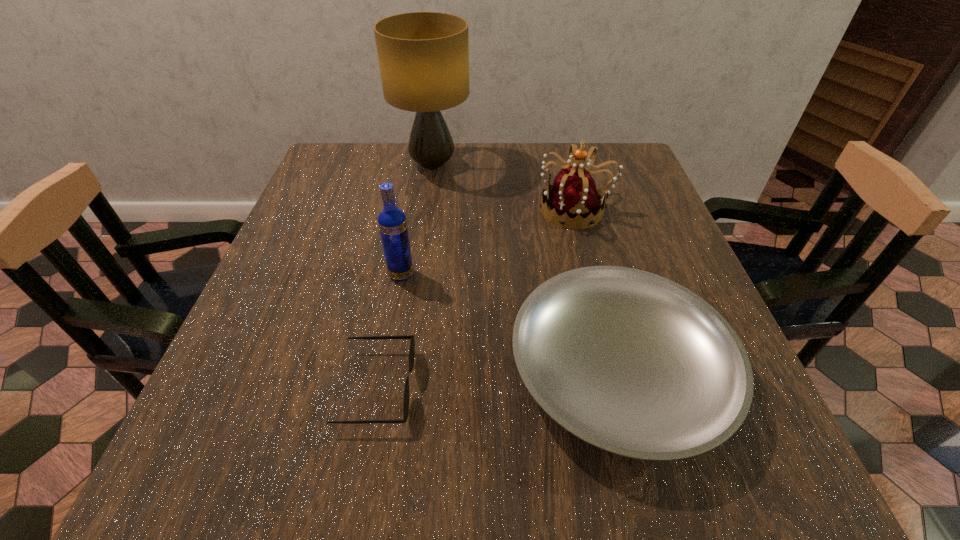
Find the location of a particular element. The width and height of the screenshot is (960, 540). the farthest object is located at coordinates (423, 57).

Identify the location of the tallest object. The height and width of the screenshot is (540, 960). (423, 57).

Locate an element on the screen. the third nearest object is located at coordinates (392, 222).

At what (x,y) coordinates should I click in order to perform the action: click on the second farthest object. Please return your answer as a coordinate pair (x, y). This screenshot has width=960, height=540. Looking at the image, I should click on (574, 199).

The image size is (960, 540). I want to click on tiara, so click(574, 199).

Identify the location of bedpan. (633, 363).

What are the coordinates of `sunglasses` in the screenshot? It's located at (412, 343).

Where is `free region located 0.060m on the left of the farthest object`? free region located 0.060m on the left of the farthest object is located at coordinates (373, 165).

Identify the location of free space located 0.170m on the back of the vodka. (412, 217).

I want to click on blank space located 0.200m on the front-facing side of the tiara, so click(x=455, y=210).